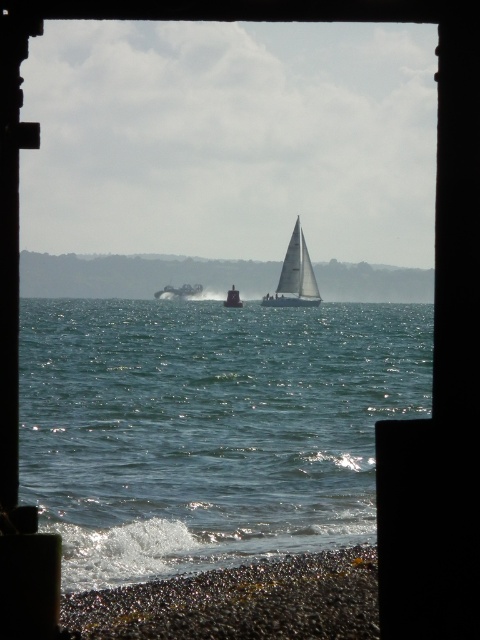
Question: Does clear blue water at center have a smaller size compared to white plastic sailboat at center?

Choices:
 (A) yes
 (B) no

Answer: (B)

Question: Which of the following is the farthest from the observer?

Choices:
 (A) clear blue water at center
 (B) white sailboat at center

Answer: (B)

Question: Can you confirm if clear blue water at center is positioned above white matte horizon at center?

Choices:
 (A) yes
 (B) no

Answer: (B)

Question: Does clear blue water at center appear on the left side of white sailboat at center?

Choices:
 (A) no
 (B) yes

Answer: (B)

Question: Which of the following is the closest to the observer?

Choices:
 (A) white sailboat at center
 (B) metallic silver boat at center

Answer: (A)

Question: Estimate the real-world distances between objects in this image. Which object is closer to the white plastic sailboat at center?

Choices:
 (A) white matte horizon at center
 (B) white sailboat at center
 (C) smooth pebbles at lower left
 (D) metallic silver boat at center

Answer: (B)